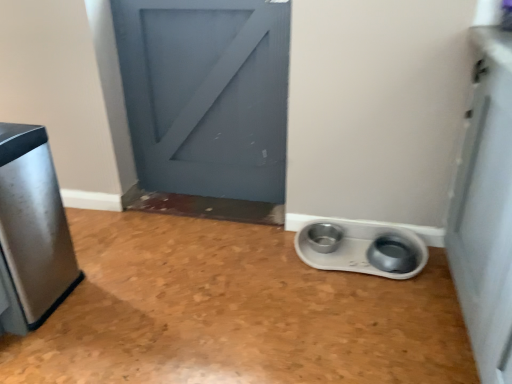
Question: From a real-world perspective, is white plastic pet bowls at lower right located beneath brushed metal trash can at left?

Choices:
 (A) yes
 (B) no

Answer: (A)

Question: Is white plastic pet bowls at lower right oriented towards brushed metal trash can at left?

Choices:
 (A) no
 (B) yes

Answer: (A)

Question: From the image's perspective, is white plastic pet bowls at lower right under brushed metal trash can at left?

Choices:
 (A) no
 (B) yes

Answer: (B)

Question: Is white plastic pet bowls at lower right shorter than brushed metal trash can at left?

Choices:
 (A) yes
 (B) no

Answer: (A)

Question: Is brushed metal trash can at left at the back of white plastic pet bowls at lower right?

Choices:
 (A) no
 (B) yes

Answer: (A)

Question: Can you confirm if white plastic pet bowls at lower right is wider than brushed metal trash can at left?

Choices:
 (A) no
 (B) yes

Answer: (A)

Question: Is brushed metal trash can at left outside white plastic pet bowls at lower right?

Choices:
 (A) no
 (B) yes

Answer: (B)

Question: Does brushed metal trash can at left lie behind white plastic pet bowls at lower right?

Choices:
 (A) yes
 (B) no

Answer: (B)

Question: From the image's perspective, is brushed metal trash can at left over white plastic pet bowls at lower right?

Choices:
 (A) yes
 (B) no

Answer: (A)

Question: From the image's perspective, is brushed metal trash can at left under white plastic pet bowls at lower right?

Choices:
 (A) no
 (B) yes

Answer: (A)

Question: Can you confirm if brushed metal trash can at left is positioned to the right of white plastic pet bowls at lower right?

Choices:
 (A) yes
 (B) no

Answer: (B)

Question: Is white plastic pet bowls at lower right at the back of brushed metal trash can at left?

Choices:
 (A) no
 (B) yes

Answer: (A)

Question: In the image, is brushed metal trash can at left on the left side or the right side of white plastic pet bowls at lower right?

Choices:
 (A) left
 (B) right

Answer: (A)